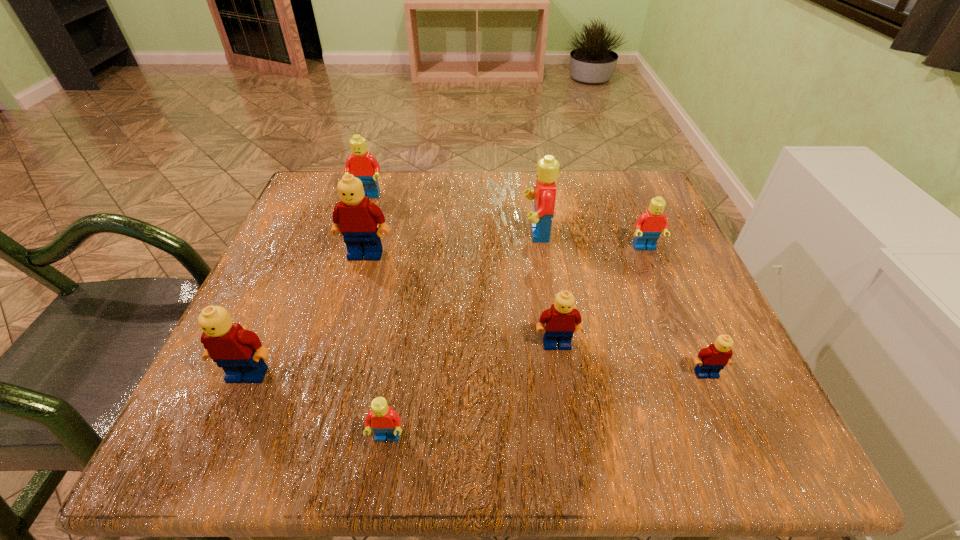
Where is `the sixth closest object to the biggest yellow Lego`? the sixth closest object to the biggest yellow Lego is located at coordinates (652, 222).

Identify the location of object that stands as the closest to the biggest yellow Lego. The image size is (960, 540). (361, 164).

Identify which Lego is located as the nearest to the fourth nearest object. Please provide its 2D coordinates. Your answer should be formatted as a tuple, i.e. [(x, y)], where the tuple contains the x and y coordinates of a point satisfying the conditions above.

[(709, 362)]

Identify which Lego is the fifth nearest to the biggest red Lego. Please provide its 2D coordinates. Your answer should be formatted as a tuple, i.e. [(x, y)], where the tuple contains the x and y coordinates of a point satisfying the conditions above.

[(709, 362)]

The height and width of the screenshot is (540, 960). I want to click on red Lego that is the second nearest to the farthest yellow Lego, so click(x=544, y=193).

Locate which red Lego ranks in proximity to the third red Lego from right to left. Please provide its 2D coordinates. Your answer should be formatted as a tuple, i.e. [(x, y)], where the tuple contains the x and y coordinates of a point satisfying the conditions above.

[(544, 193)]

The height and width of the screenshot is (540, 960). In order to click on yellow Lego that can be found as the second closest to the rightmost yellow Lego in this screenshot , I will do `click(355, 217)`.

Point out which yellow Lego is positioned as the second nearest to the fifth object from right to left. Please provide its 2D coordinates. Your answer should be formatted as a tuple, i.e. [(x, y)], where the tuple contains the x and y coordinates of a point satisfying the conditions above.

[(562, 320)]